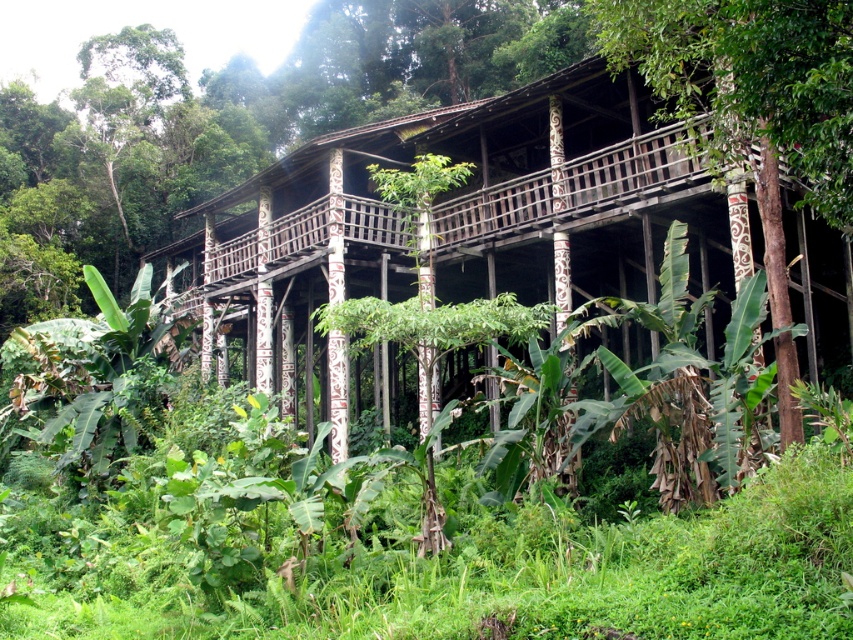
Describe the element at coordinates (460, 209) in the screenshot. I see `wooden hut at center` at that location.

Is the position of wooden hut at center more distant than that of brown wood pole at center?

Yes, it is behind brown wood pole at center.

Does point (399, 278) come in front of point (770, 17)?

No, it is not.

The height and width of the screenshot is (640, 853). What are the coordinates of `wooden hut at center` in the screenshot? It's located at (460, 209).